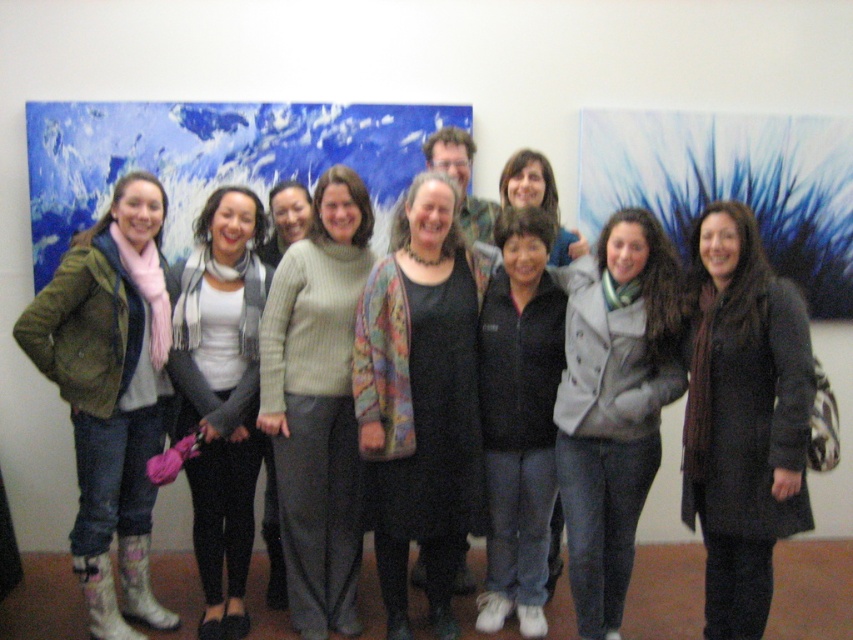
You are standing in the gallery and want to take a photo of the knit sweater at center. Where should you aim your camera to capture it?

The knit sweater at center is located at coordinates point 0.633 on the x axis and 0.373 on the y axis, so aim your camera there to capture it.

You are organizing a charity event and need to determine which clothing item from the group photo takes up more space. Which is larger between the knit sweater at center and the black fleece jacket at center?

The black fleece jacket at center is larger than the knit sweater at center.